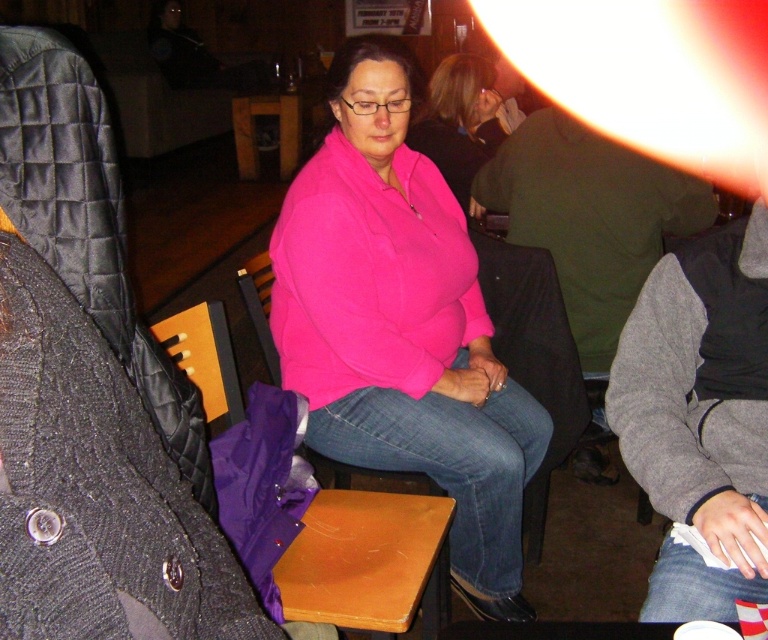
Question: Is pink fleece at center smaller than pink matte sweater at center?

Choices:
 (A) no
 (B) yes

Answer: (A)

Question: Which point is closer to the camera?

Choices:
 (A) (444, 120)
 (B) (288, 237)
 (C) (267, 96)
 (D) (333, 584)

Answer: (D)

Question: Is pink fleece at center closer to camera compared to wooden at center?

Choices:
 (A) yes
 (B) no

Answer: (B)

Question: In this image, where is pink fleece at center located relative to wooden chair at center?

Choices:
 (A) right
 (B) left

Answer: (A)

Question: Based on their relative distances, which object is farther from the pink fleece at center?

Choices:
 (A) wooden table at center
 (B) wooden at center

Answer: (A)

Question: Based on their relative distances, which object is farther from the wooden at center?

Choices:
 (A) wooden table at center
 (B) wooden chair at center

Answer: (A)